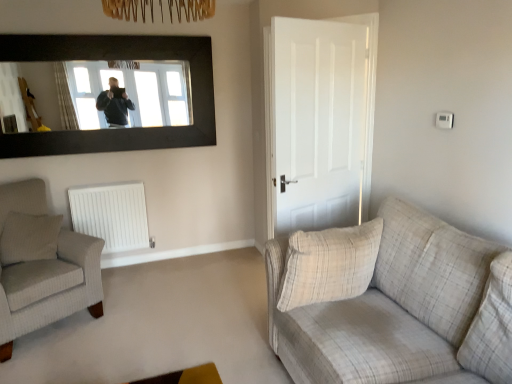
Question: From a real-world perspective, is beige plaid pillow at right, arranged as the 1th pillow when viewed from the right, beneath plaid fabric couch at right?

Choices:
 (A) yes
 (B) no

Answer: (B)

Question: Is beige plaid pillow at right, arranged as the 1th pillow when viewed from the right, oriented towards plaid fabric couch at right?

Choices:
 (A) no
 (B) yes

Answer: (B)

Question: From the image's perspective, is beige plaid pillow at right, arranged as the 1th pillow when viewed from the right, over plaid fabric couch at right?

Choices:
 (A) no
 (B) yes

Answer: (B)

Question: Considering the relative sizes of beige plaid pillow at right, positioned as the 2th pillow in left-to-right order, and plaid fabric couch at right in the image provided, is beige plaid pillow at right, positioned as the 2th pillow in left-to-right order, smaller than plaid fabric couch at right?

Choices:
 (A) no
 (B) yes

Answer: (B)

Question: Is beige plaid pillow at right, arranged as the 1th pillow when viewed from the right, positioned with its back to plaid fabric couch at right?

Choices:
 (A) no
 (B) yes

Answer: (B)

Question: Is beige plaid pillow at right, which ranks as the second pillow in back-to-front order, beside plaid fabric couch at right?

Choices:
 (A) yes
 (B) no

Answer: (B)

Question: Considering the relative sizes of plaid fabric couch at right and beige plaid pillow at right, positioned as the 2th pillow in left-to-right order, in the image provided, is plaid fabric couch at right thinner than beige plaid pillow at right, positioned as the 2th pillow in left-to-right order,?

Choices:
 (A) no
 (B) yes

Answer: (A)

Question: Is plaid fabric couch at right positioned before beige plaid pillow at right, which ranks as the second pillow in back-to-front order?

Choices:
 (A) yes
 (B) no

Answer: (A)

Question: Does plaid fabric couch at right have a greater height compared to beige plaid pillow at right, which ranks as the second pillow in back-to-front order?

Choices:
 (A) yes
 (B) no

Answer: (A)

Question: Is plaid fabric couch at right positioned behind beige plaid pillow at right, which ranks as the second pillow in back-to-front order?

Choices:
 (A) yes
 (B) no

Answer: (B)

Question: Does plaid fabric couch at right have a larger size compared to beige plaid pillow at right, positioned as the 2th pillow in left-to-right order?

Choices:
 (A) yes
 (B) no

Answer: (A)

Question: Could you tell me if plaid fabric couch at right is facing beige plaid pillow at right, which ranks as the second pillow in back-to-front order?

Choices:
 (A) yes
 (B) no

Answer: (A)

Question: Considering the relative sizes of white matte door at center and beige textured pillow at left, which is the 2th pillow in front-to-back order, in the image provided, is white matte door at center smaller than beige textured pillow at left, which is the 2th pillow in front-to-back order,?

Choices:
 (A) yes
 (B) no

Answer: (B)